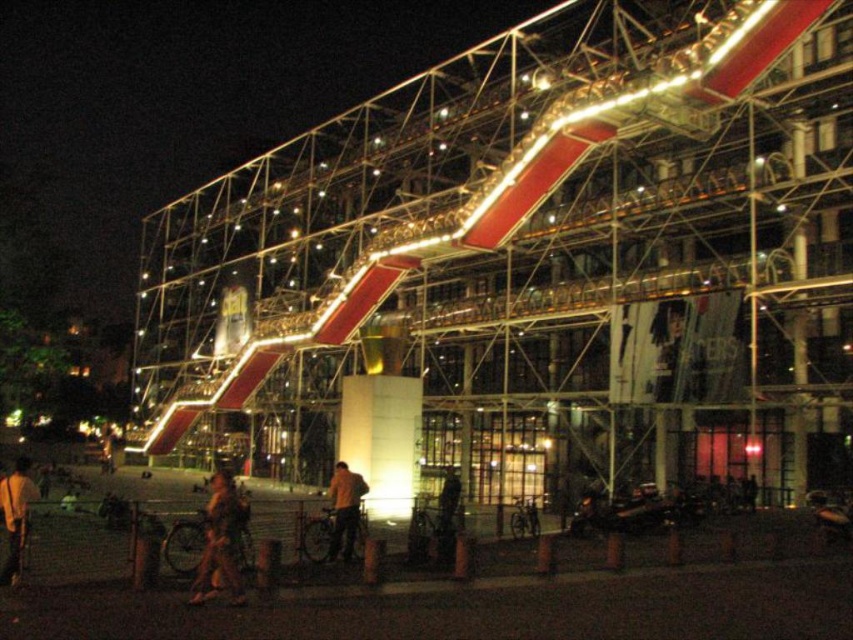
Consider the image. You are a photographer standing in the foreground of the scene. You want to capture both the camouflage fabric jacket at lower center and the yellow fabric jacket at center in a single photo. Which jacket will appear closer to the camera in the photo?

The camouflage fabric jacket at lower center will appear closer to the camera in the photo because it is in front of the yellow fabric jacket at center.